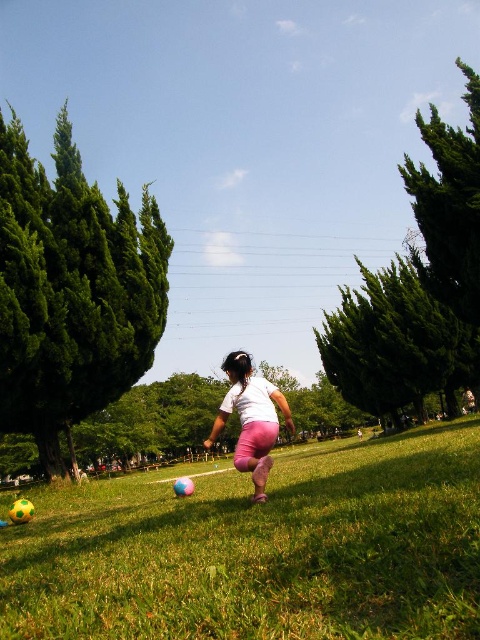
You are a photographer trying to capture a wide shot of the scene. Considering the green grassy field at center and the white matte shirt at center, which object is wider in the image?

The green grassy field at center is wider than the white matte shirt at center.

You are standing in the park and see the green grassy field at center and the white matte shirt at center. Which one is closer to you?

The green grassy field at center is closer to you because it is in front of the white matte shirt at center.